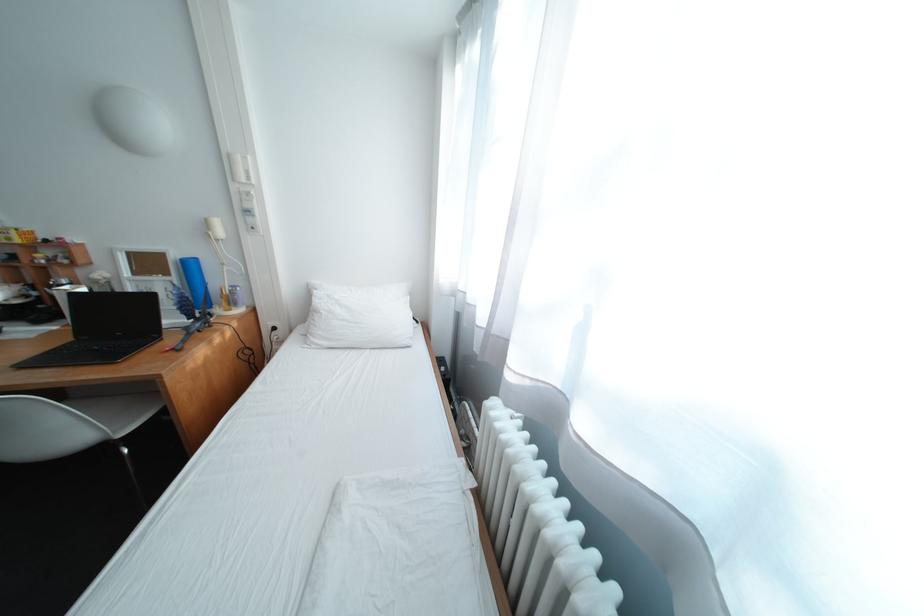
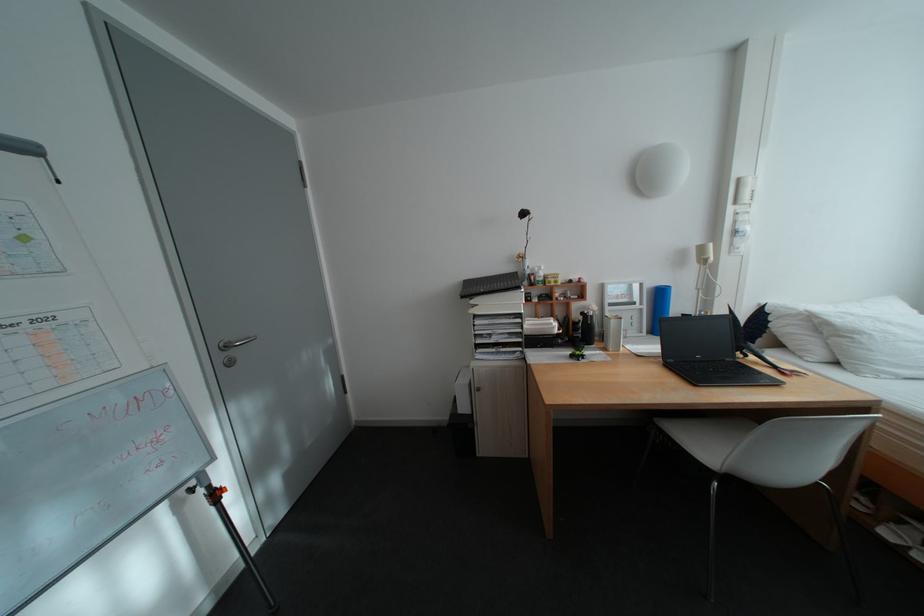
Find the pixel in the second image that matches the point at 187,280 in the first image.

(657, 307)